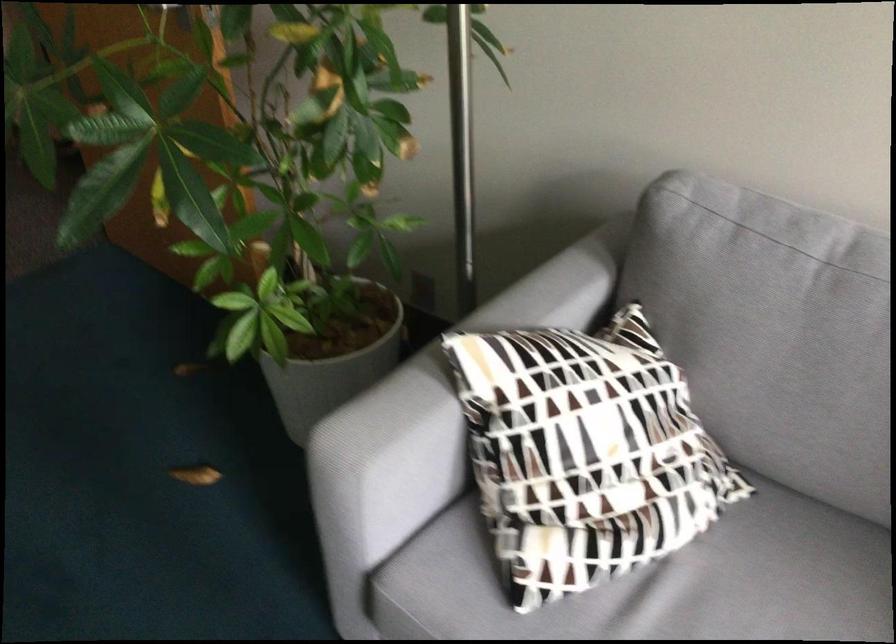
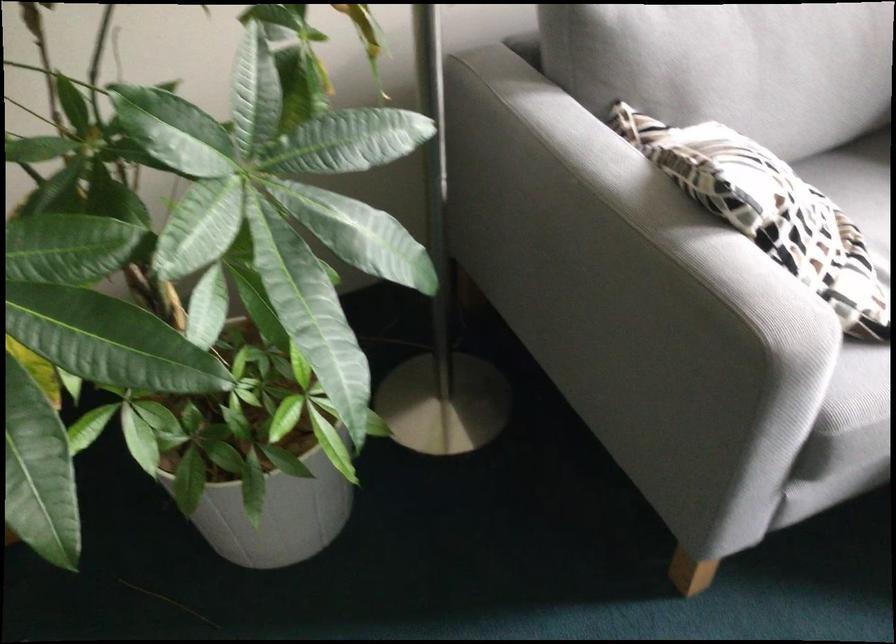
Question: I am providing you with two images of the same scene from different viewpoints. After the viewpoint changes to image2, which objects are now occluded?

Choices:
 (A) sofa armrest
 (B) white plant pot
 (C) red ping pong paddle
 (D) patterned cushion

Answer: (B)